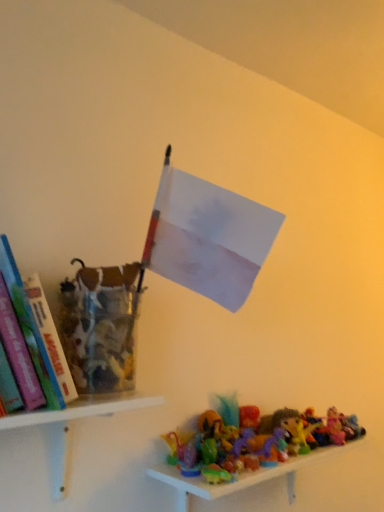
In order to face hardcover book at left, should I rotate leftwards or rightwards?

It's best to rotate left around 21.374 degrees.

At what (x,y) coordinates should I click in order to perform the action: click on hardcover book at left. Please return your answer as a coordinate pair (x, y). This screenshot has height=512, width=384. Looking at the image, I should click on (35, 331).

Locate an element on the screen. translucent plastic toys at lower right, which is the 1th shelf from right to left is located at coordinates (242, 476).

This screenshot has width=384, height=512. Describe the element at coordinates (242, 476) in the screenshot. I see `translucent plastic toys at lower right, positioned as the first shelf in bottom-to-top order` at that location.

At what (x,y) coordinates should I click in order to perform the action: click on white plastic shelf at lower left, the first shelf when ordered from top to bottom. Please return your answer as a coordinate pair (x, y). The image size is (384, 512). Looking at the image, I should click on (76, 419).

From a real-world perspective, is hardcover book at left positioned under translucent plastic toys at lower right, positioned as the first shelf in bottom-to-top order, based on gravity?

No.

Considering the sizes of objects hardcover book at left and translucent plastic toys at lower right, positioned as the first shelf in bottom-to-top order, in the image provided, who is wider, hardcover book at left or translucent plastic toys at lower right, positioned as the first shelf in bottom-to-top order,?

Wider between the two is hardcover book at left.

Is there a large distance between hardcover book at left and translucent plastic toys at lower right, which is the 1th shelf from right to left?

No, hardcover book at left is not far from translucent plastic toys at lower right, which is the 1th shelf from right to left.

From the picture: From the image's perspective, is hardcover book at left above or below translucent plastic toys at lower right, which is the 1th shelf from right to left?

hardcover book at left is above translucent plastic toys at lower right, which is the 1th shelf from right to left.

Which of these two, hardcover book at left or white plastic shelf at lower left, which ranks as the second shelf in bottom-to-top order, is smaller?

With smaller size is hardcover book at left.

Considering the relative sizes of hardcover book at left and white plastic shelf at lower left, which ranks as the second shelf in bottom-to-top order, in the image provided, is hardcover book at left shorter than white plastic shelf at lower left, which ranks as the second shelf in bottom-to-top order,?

No.

Is hardcover book at left inside the boundaries of white plastic shelf at lower left, acting as the 2th shelf starting from the right, or outside?

hardcover book at left cannot be found inside white plastic shelf at lower left, acting as the 2th shelf starting from the right.

Is point (15, 298) positioned after point (27, 418)?

No, it is in front of (27, 418).

From a real-world perspective, which is physically above, white plastic shelf at lower left, acting as the 2th shelf starting from the right, or translucent plastic toys at lower right, positioned as the first shelf in bottom-to-top order?

In real-world perspective, white plastic shelf at lower left, acting as the 2th shelf starting from the right, is above.

In terms of size, does white plastic shelf at lower left, the first shelf when ordered from top to bottom, appear bigger or smaller than translucent plastic toys at lower right, marked as the 2th shelf in a top-to-bottom arrangement?

In the image, white plastic shelf at lower left, the first shelf when ordered from top to bottom, appears to be smaller than translucent plastic toys at lower right, marked as the 2th shelf in a top-to-bottom arrangement.

Which is in front, point (159, 396) or point (270, 470)?

Positioned in front is point (270, 470).

From a real-world perspective, is translucent plastic toys at lower right, positioned as the first shelf in bottom-to-top order, positioned over white plastic shelf at lower left, the first shelf when ordered from top to bottom, based on gravity?

No, from a real-world perspective, translucent plastic toys at lower right, positioned as the first shelf in bottom-to-top order, is not on top of white plastic shelf at lower left, the first shelf when ordered from top to bottom.

Between translucent plastic toys at lower right, marked as the 2th shelf in a top-to-bottom arrangement, and white plastic shelf at lower left, the first shelf positioned from the left, which one has smaller size?

white plastic shelf at lower left, the first shelf positioned from the left, is smaller.

Considering the relative positions of translucent plastic toys at lower right, which is the second shelf in left-to-right order, and white plastic shelf at lower left, acting as the 2th shelf starting from the right, in the image provided, is translucent plastic toys at lower right, which is the second shelf in left-to-right order, to the left of white plastic shelf at lower left, acting as the 2th shelf starting from the right, from the viewer's perspective?

Incorrect, translucent plastic toys at lower right, which is the second shelf in left-to-right order, is not on the left side of white plastic shelf at lower left, acting as the 2th shelf starting from the right.

Consider the image. From a real-world perspective, is translucent plastic toys at lower right, which is the second shelf in left-to-right order, over hardcover book at left?

No, from a real-world perspective, translucent plastic toys at lower right, which is the second shelf in left-to-right order, is not over hardcover book at left

Between translucent plastic toys at lower right, which is the second shelf in left-to-right order, and hardcover book at left, which one has larger width?

hardcover book at left.

Is translucent plastic toys at lower right, marked as the 2th shelf in a top-to-bottom arrangement, outside of hardcover book at left?

translucent plastic toys at lower right, marked as the 2th shelf in a top-to-bottom arrangement, is positioned outside hardcover book at left.

Considering the points (325, 447) and (43, 386), which point is in front, point (325, 447) or point (43, 386)?

The point (43, 386) is more forward.

Looking at their sizes, would you say white plastic shelf at lower left, the first shelf positioned from the left, is wider or thinner than hardcover book at left?

Considering their sizes, white plastic shelf at lower left, the first shelf positioned from the left, looks slimmer than hardcover book at left.

Locate an element on the screen. the 1st shelf counting from the right of the hardcover book at left is located at coordinates (76, 419).

From the image's perspective, is white plastic shelf at lower left, the first shelf positioned from the left, over hardcover book at left?

Actually, white plastic shelf at lower left, the first shelf positioned from the left, appears below hardcover book at left in the image.

Identify the location of the 2nd shelf positioned below the hardcover book at left (from a real-world perspective). The image size is (384, 512). (242, 476).

Where is `book above the white plastic shelf at lower left, the first shelf positioned from the left (from the image's perspective)`? The height and width of the screenshot is (512, 384). book above the white plastic shelf at lower left, the first shelf positioned from the left (from the image's perspective) is located at coordinates (35, 331).

From the image, which object appears to be nearer to translucent plastic toys at lower right, marked as the 2th shelf in a top-to-bottom arrangement, white plastic shelf at lower left, the first shelf positioned from the left, or hardcover book at left?

white plastic shelf at lower left, the first shelf positioned from the left, lies closer to translucent plastic toys at lower right, marked as the 2th shelf in a top-to-bottom arrangement, than the other object.

Based on their spatial positions, is hardcover book at left or white plastic shelf at lower left, the first shelf when ordered from top to bottom, further from translucent plastic toys at lower right, which is the second shelf in left-to-right order?

Among the two, hardcover book at left is located further to translucent plastic toys at lower right, which is the second shelf in left-to-right order.

Estimate the real-world distances between objects in this image. Which object is closer to hardcover book at left, white plastic shelf at lower left, the first shelf positioned from the left, or translucent plastic toys at lower right, marked as the 2th shelf in a top-to-bottom arrangement?

white plastic shelf at lower left, the first shelf positioned from the left, is positioned closer to the anchor hardcover book at left.

Looking at the image, which one is located closer to hardcover book at left, translucent plastic toys at lower right, marked as the 2th shelf in a top-to-bottom arrangement, or white plastic shelf at lower left, the first shelf positioned from the left?

The object closer to hardcover book at left is white plastic shelf at lower left, the first shelf positioned from the left.

Looking at the image, which one is located closer to white plastic shelf at lower left, which ranks as the second shelf in bottom-to-top order, hardcover book at left or translucent plastic toys at lower right, marked as the 2th shelf in a top-to-bottom arrangement?

hardcover book at left is closer to white plastic shelf at lower left, which ranks as the second shelf in bottom-to-top order.

Looking at the image, which one is located closer to white plastic shelf at lower left, the first shelf when ordered from top to bottom, translucent plastic toys at lower right, marked as the 2th shelf in a top-to-bottom arrangement, or hardcover book at left?

Among the two, hardcover book at left is located nearer to white plastic shelf at lower left, the first shelf when ordered from top to bottom.

Image resolution: width=384 pixels, height=512 pixels. I want to click on shelf between hardcover book at left and translucent plastic toys at lower right, positioned as the first shelf in bottom-to-top order, from left to right, so click(x=76, y=419).